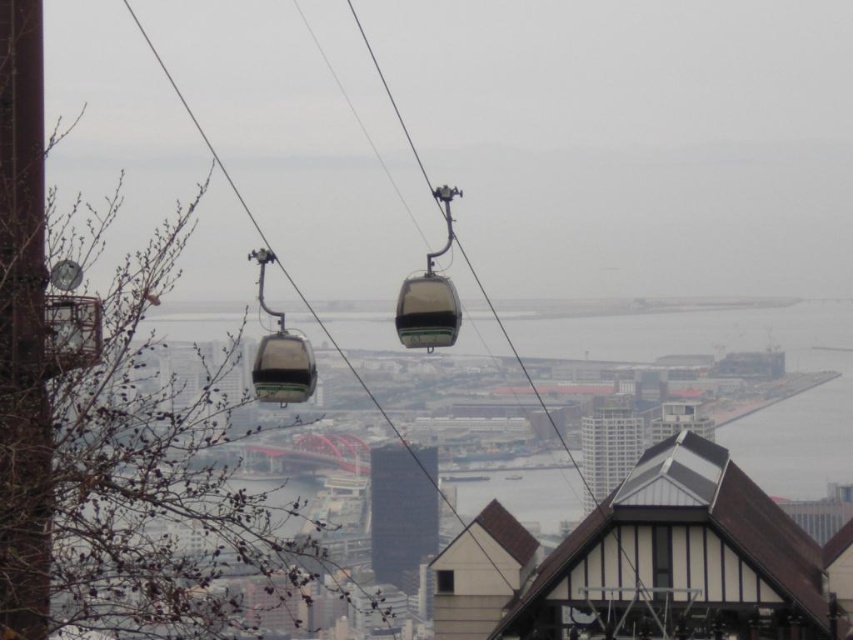
Question: Is matte black cable car at center further to the viewer compared to transparent glass cabin at center?

Choices:
 (A) yes
 (B) no

Answer: (A)

Question: Which of the following is the farthest from the observer?

Choices:
 (A) matte black cable car at center
 (B) translucent plastic gondola at center

Answer: (A)

Question: Which point is farther to the camera?

Choices:
 (A) matte black cable car at center
 (B) translucent plastic gondola at center
 (C) transparent glass cabin at center

Answer: (A)

Question: Is matte black cable car at center positioned before transparent glass cabin at center?

Choices:
 (A) yes
 (B) no

Answer: (B)

Question: Which point is farther to the camera?

Choices:
 (A) matte black cable car at center
 (B) transparent glass cabin at center
 (C) translucent plastic gondola at center

Answer: (A)

Question: Can you confirm if matte black cable car at center is positioned above transparent glass cabin at center?

Choices:
 (A) no
 (B) yes

Answer: (A)